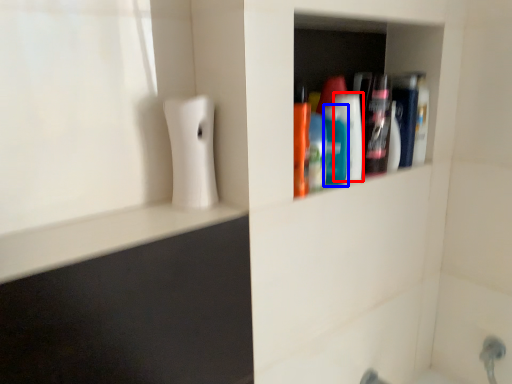
Question: Which point is further to the camera, mouthwash (highlighted by a red box) or mouthwash (highlighted by a blue box)?

Choices:
 (A) mouthwash
 (B) mouthwash

Answer: (A)